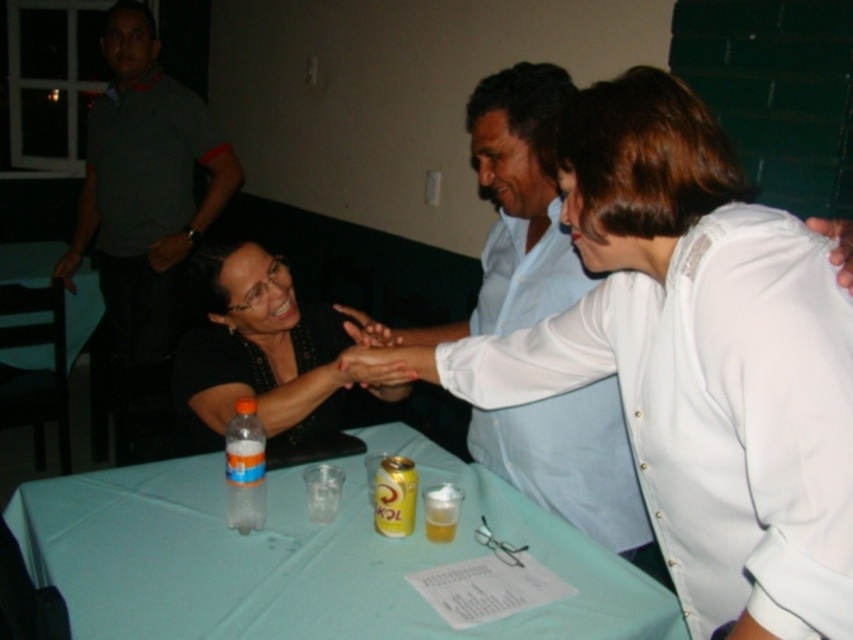
Who is shorter, light blue fabric table at lower center or dark gray polo shirt at upper left?

light blue fabric table at lower center is shorter.

Does light blue fabric table at lower center appear on the left side of dark gray polo shirt at upper left?

In fact, light blue fabric table at lower center is to the right of dark gray polo shirt at upper left.

Does point (341, 596) come in front of point (177, 280)?

Yes, point (341, 596) is in front of point (177, 280).

Where is `light blue fabric table at lower center`? light blue fabric table at lower center is located at coordinates (303, 557).

Does dark gray polo shirt at upper left have a lesser width compared to green plastic table at lower left?

Correct, dark gray polo shirt at upper left's width is less than green plastic table at lower left's.

Is dark gray polo shirt at upper left wider than green plastic table at lower left?

In fact, dark gray polo shirt at upper left might be narrower than green plastic table at lower left.

Describe the element at coordinates (144, 196) in the screenshot. This screenshot has height=640, width=853. I see `dark gray polo shirt at upper left` at that location.

Image resolution: width=853 pixels, height=640 pixels. Identify the location of dark gray polo shirt at upper left. (144, 196).

Between point (207, 280) and point (10, 337), which one is positioned in front?

Point (207, 280) is more forward.

How far apart are black matte shirt at center and green plastic table at lower left?

The distance of black matte shirt at center from green plastic table at lower left is 4.74 feet.

What do you see at coordinates (267, 353) in the screenshot? I see `black matte shirt at center` at bounding box center [267, 353].

Where is `black matte shirt at center`? black matte shirt at center is located at coordinates (267, 353).